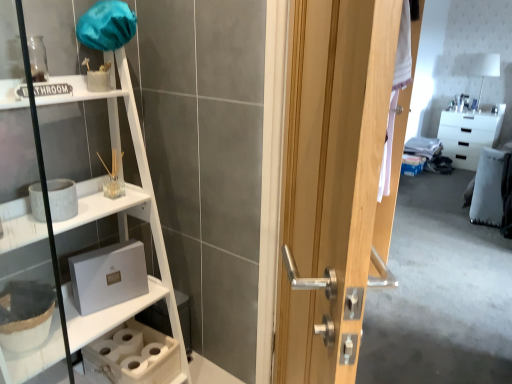
Question: Is white glossy cabinet at upper right at the left side of white wood shelf at left?

Choices:
 (A) yes
 (B) no

Answer: (B)

Question: Would you say white glossy cabinet at upper right is outside white wood shelf at left?

Choices:
 (A) yes
 (B) no

Answer: (A)

Question: From a real-world perspective, is white glossy cabinet at upper right under white wood shelf at left?

Choices:
 (A) yes
 (B) no

Answer: (A)

Question: Is white glossy cabinet at upper right smaller than white wood shelf at left?

Choices:
 (A) yes
 (B) no

Answer: (A)

Question: Is white glossy cabinet at upper right taller than white wood shelf at left?

Choices:
 (A) yes
 (B) no

Answer: (B)

Question: Considering the relative sizes of white glossy cabinet at upper right and white wood shelf at left in the image provided, is white glossy cabinet at upper right shorter than white wood shelf at left?

Choices:
 (A) no
 (B) yes

Answer: (B)

Question: Does white glossy cabinet at upper right have a lesser width compared to wooden door at center?

Choices:
 (A) yes
 (B) no

Answer: (B)

Question: Can you confirm if white glossy cabinet at upper right is wider than wooden door at center?

Choices:
 (A) no
 (B) yes

Answer: (B)

Question: Can wooden door at center be found inside white glossy cabinet at upper right?

Choices:
 (A) yes
 (B) no

Answer: (B)

Question: Is white glossy cabinet at upper right closer to the viewer compared to wooden door at center?

Choices:
 (A) yes
 (B) no

Answer: (B)

Question: Can you confirm if white glossy cabinet at upper right is smaller than wooden door at center?

Choices:
 (A) no
 (B) yes

Answer: (B)

Question: Does white glossy cabinet at upper right lie behind wooden door at center?

Choices:
 (A) no
 (B) yes

Answer: (B)

Question: Is the depth of wooden door at center greater than that of white glossy cabinet at upper right?

Choices:
 (A) no
 (B) yes

Answer: (A)